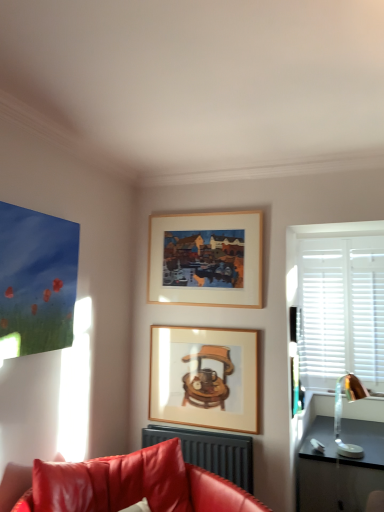
Question: Can you confirm if matte black radiator at lower center is shorter than wooden picture frame at center, marked as the first picture frame in a bottom-to-top arrangement?

Choices:
 (A) yes
 (B) no

Answer: (A)

Question: Does matte black radiator at lower center have a smaller size compared to wooden picture frame at center, marked as the first picture frame in a bottom-to-top arrangement?

Choices:
 (A) yes
 (B) no

Answer: (B)

Question: Considering the relative sizes of matte black radiator at lower center and wooden picture frame at center, the second picture frame in the top-to-bottom sequence, in the image provided, is matte black radiator at lower center wider than wooden picture frame at center, the second picture frame in the top-to-bottom sequence,?

Choices:
 (A) no
 (B) yes

Answer: (B)

Question: Would you say matte black radiator at lower center is a long distance from wooden picture frame at center, the second picture frame in the top-to-bottom sequence?

Choices:
 (A) no
 (B) yes

Answer: (A)

Question: Considering the relative sizes of matte black radiator at lower center and wooden picture frame at center, marked as the first picture frame in a bottom-to-top arrangement, in the image provided, is matte black radiator at lower center thinner than wooden picture frame at center, marked as the first picture frame in a bottom-to-top arrangement,?

Choices:
 (A) yes
 (B) no

Answer: (B)

Question: From their relative heights in the image, would you say leather couch at lower left is taller or shorter than metallic gold lamp at right?

Choices:
 (A) tall
 (B) short

Answer: (A)

Question: Considering the relative positions of leather couch at lower left and metallic gold lamp at right in the image provided, is leather couch at lower left to the left or to the right of metallic gold lamp at right?

Choices:
 (A) left
 (B) right

Answer: (A)

Question: From the image's perspective, relative to metallic gold lamp at right, is leather couch at lower left above or below?

Choices:
 (A) above
 (B) below

Answer: (B)

Question: Does point (124, 486) appear closer or farther from the camera than point (364, 391)?

Choices:
 (A) farther
 (B) closer

Answer: (B)

Question: Considering their positions, is matte black radiator at lower center located in front of or behind metallic gold lamp at right?

Choices:
 (A) behind
 (B) front

Answer: (B)

Question: Would you say matte black radiator at lower center is inside or outside metallic gold lamp at right?

Choices:
 (A) inside
 (B) outside

Answer: (B)

Question: Based on their sizes in the image, would you say matte black radiator at lower center is bigger or smaller than metallic gold lamp at right?

Choices:
 (A) big
 (B) small

Answer: (A)

Question: In terms of height, does matte black radiator at lower center look taller or shorter compared to metallic gold lamp at right?

Choices:
 (A) short
 (B) tall

Answer: (A)

Question: In the image, is matte black radiator at lower center positioned in front of or behind wooden picture frame at center, the second picture frame in the top-to-bottom sequence?

Choices:
 (A) front
 (B) behind

Answer: (A)

Question: Do you think matte black radiator at lower center is within wooden picture frame at center, the second picture frame in the top-to-bottom sequence, or outside of it?

Choices:
 (A) inside
 (B) outside

Answer: (B)